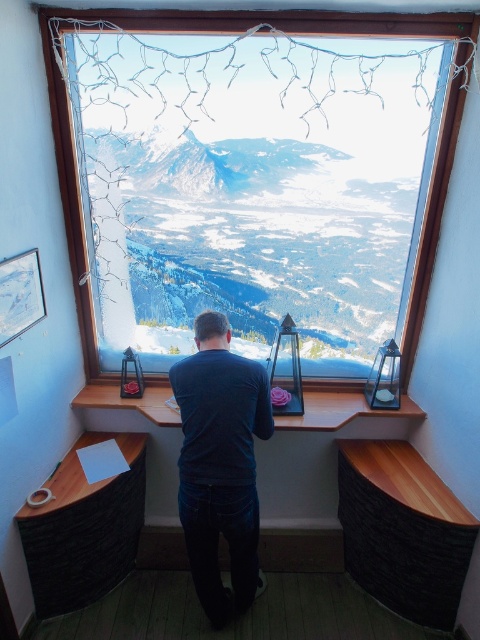
Question: Does snowy mountain at upper center have a smaller size compared to transparent glass window at center?

Choices:
 (A) yes
 (B) no

Answer: (A)

Question: Considering the real-world distances, which object is closest to the wooden at lower right?

Choices:
 (A) wooden desk at lower left
 (B) dark blue shirt at center

Answer: (B)

Question: Which object is the farthest from the wooden desk at lower left?

Choices:
 (A) transparent glass window at center
 (B) snowy mountain at upper center
 (C) wooden at lower right

Answer: (C)

Question: Does dark blue shirt at center come behind transparent glass window at center?

Choices:
 (A) yes
 (B) no

Answer: (B)

Question: Can you confirm if transparent glass window at center is positioned to the right of wooden desk at lower left?

Choices:
 (A) yes
 (B) no

Answer: (A)

Question: Which object is closer to the camera taking this photo?

Choices:
 (A) dark blue shirt at center
 (B) wooden at lower right
 (C) snowy mountain at upper center

Answer: (A)